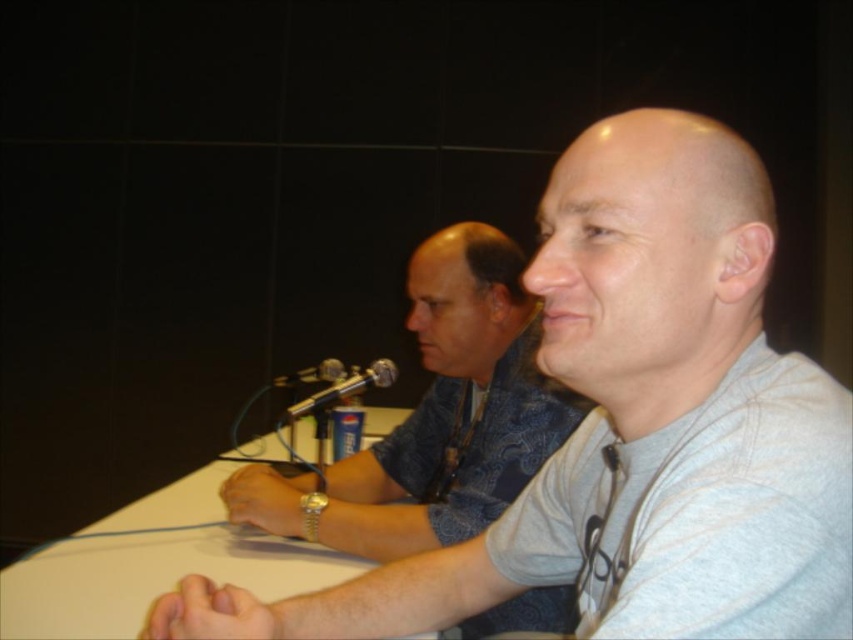
You are a photographer taking a picture of the two people seated at the table. You notice the gray cotton shirt at center and the gray fabric shirt at center. Which one is positioned higher up in the image?

The gray cotton shirt at center is positioned higher up in the image compared to the gray fabric shirt at center, as it is described to be above it.

You are a photographer standing at the current position. You want to take a portrait of the gray fabric shirt at center. What is the minimum distance you need to move forward or backward to focus on it?

The gray fabric shirt at center is 1.03 meters away from the camera. To focus on it, you should adjust your position so that you are exactly 1.03 meters away from the gray fabric shirt at center.

You are standing in front of the table where the gray cotton shirt at center is located. If you want to place a small notebook on the table without moving any existing items, where should you put it?

You should place the small notebook in the empty space near the center of the table, away from the gray cotton shirt at center and the Pepsi can to avoid disturbing them.